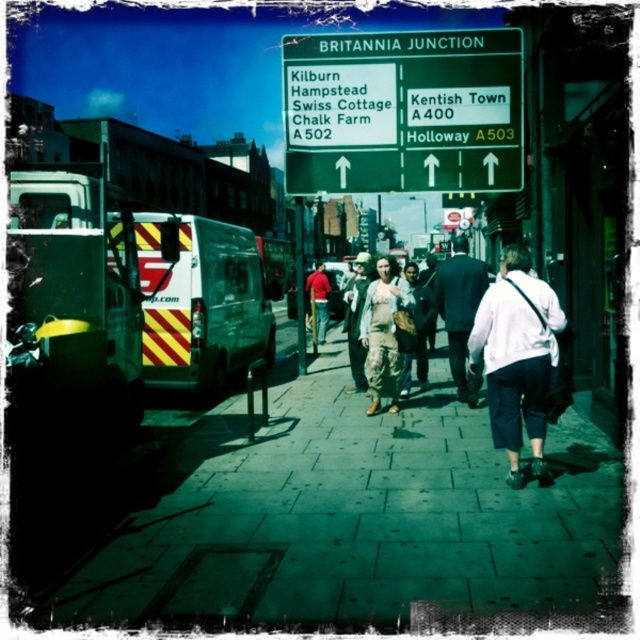
You are standing at the Britannia Junction and want to take a photo of the green directional sign. There is a white reflective van at center blocking your view. Can you estimate the van is located at what coordinates to adjust your position?

The white reflective van at center is located at coordinates approximately 0.473 on the x axis and 0.314 on the y axis.

Looking at this image, you are a delivery driver approaching Britannia Junction. You see the green metallic signboard at upper center and the green reflective ambulance at left. Which object is bigger in the image?

The green metallic signboard at upper center is larger in size compared to the green reflective ambulance at left.